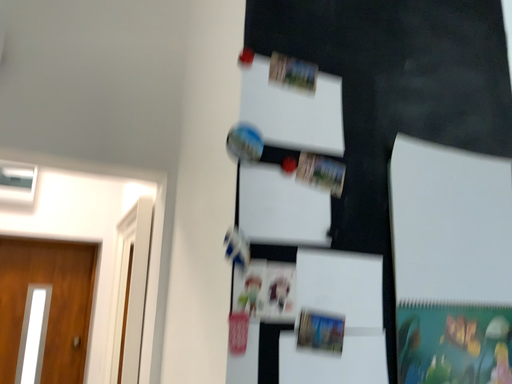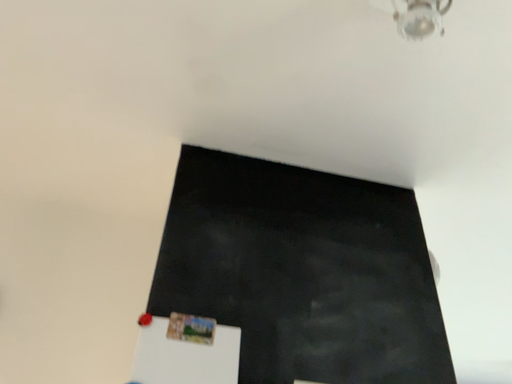
Question: Which way did the camera rotate in the video?

Choices:
 (A) rotated upward
 (B) rotated downward

Answer: (A)